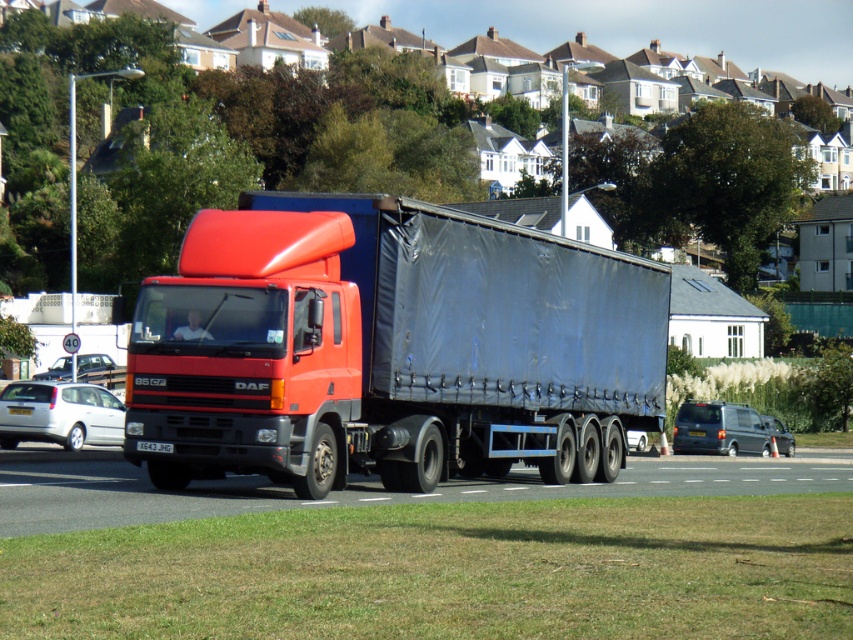
Question: Which point is closer to the camera?

Choices:
 (A) black plastic license plate at center
 (B) matte black trailer truck at center
 (C) metallic gray van at center
 (D) yellow plastic license plate at center

Answer: (B)

Question: Is matte black trailer truck at center thinner than metallic gray van at center?

Choices:
 (A) no
 (B) yes

Answer: (A)

Question: Which object is closer to the camera taking this photo?

Choices:
 (A) yellow plastic license plate at center
 (B) black plastic license plate at center

Answer: (B)

Question: Which point is closer to the camera?

Choices:
 (A) (149, 444)
 (B) (41, 390)

Answer: (A)

Question: Can you confirm if matte black trailer truck at center is positioned to the right of silver metallic hatchback at lower left?

Choices:
 (A) yes
 (B) no

Answer: (A)

Question: Does metallic gray van at center appear under silver metallic car at center?

Choices:
 (A) no
 (B) yes

Answer: (B)